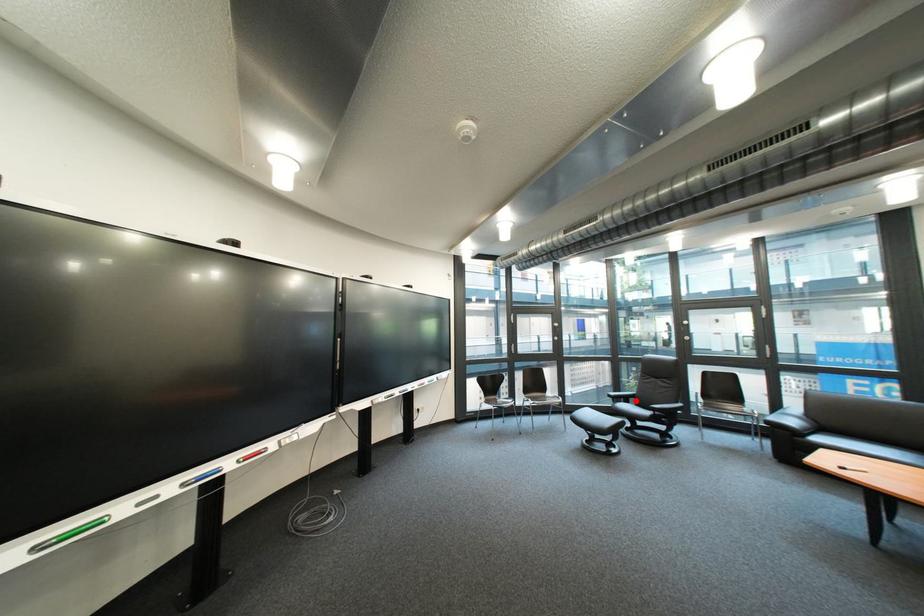
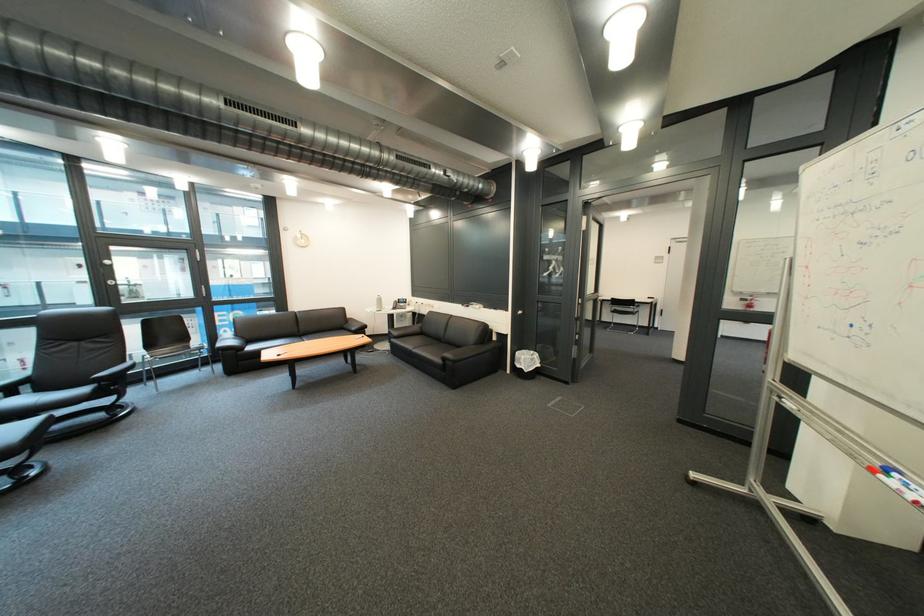
Find the pixel in the second image that matches the highlighted location in the first image.

(16, 395)